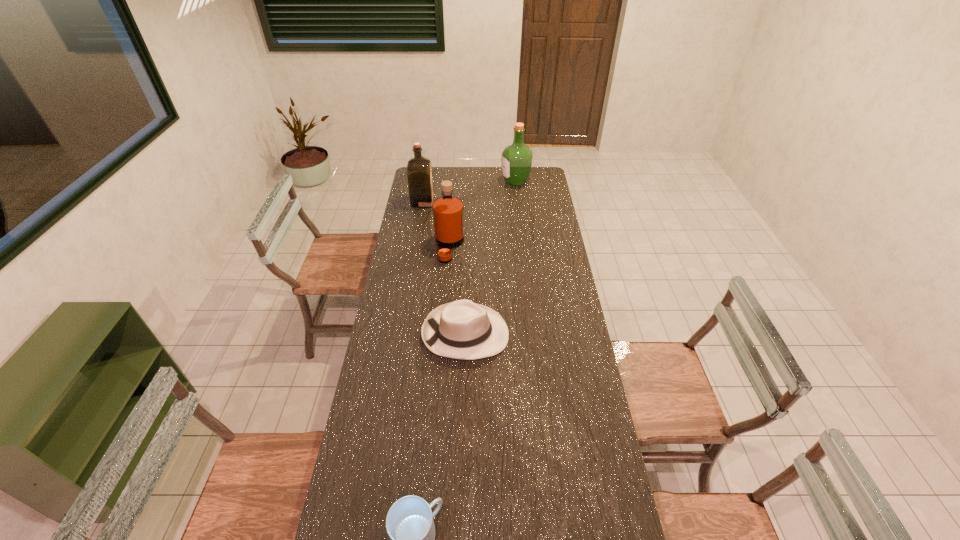
At what (x,y) coordinates should I click in order to perform the action: click on blank region between the rightmost liquor and the second farthest liquor. Please return your answer as a coordinate pair (x, y). Looking at the image, I should click on (469, 191).

The image size is (960, 540). Find the location of `vacant area that lies between the farthest object and the fourth farthest object`. vacant area that lies between the farthest object and the fourth farthest object is located at coordinates click(491, 258).

Identify the location of free spot between the rightmost liquor and the nearest liquor. The height and width of the screenshot is (540, 960). (483, 214).

Locate which object ranks second in proximity to the nearest liquor. Please provide its 2D coordinates. Your answer should be formatted as a tuple, i.e. [(x, y)], where the tuple contains the x and y coordinates of a point satisfying the conditions above.

[(464, 330)]

Locate which object is the second closest to the mug. Please provide its 2D coordinates. Your answer should be formatted as a tuple, i.e. [(x, y)], where the tuple contains the x and y coordinates of a point satisfying the conditions above.

[(448, 215)]

Image resolution: width=960 pixels, height=540 pixels. Identify the location of liquor that is the second closest to the second farthest object. (516, 164).

This screenshot has width=960, height=540. I want to click on liquor that is the nearest to the nearest object, so click(x=448, y=215).